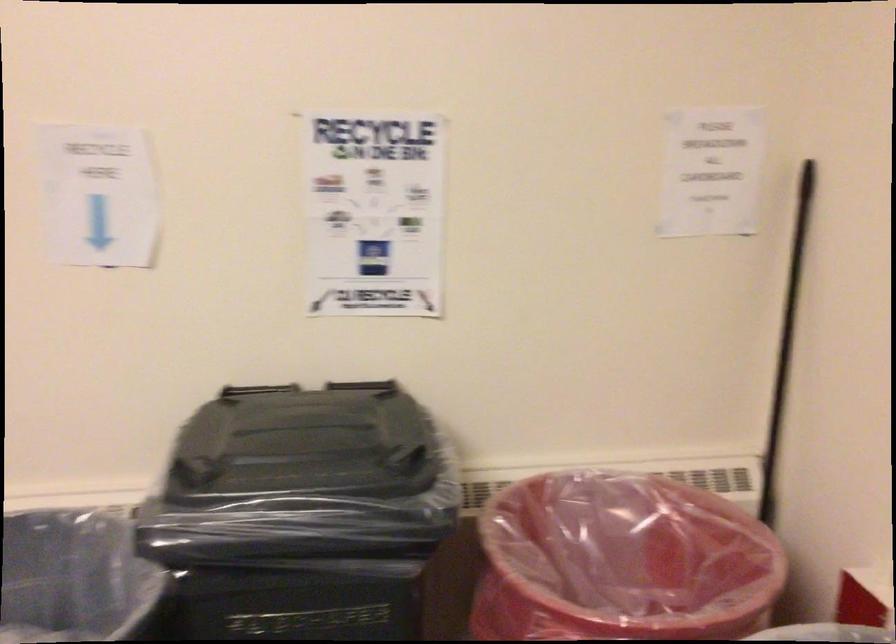
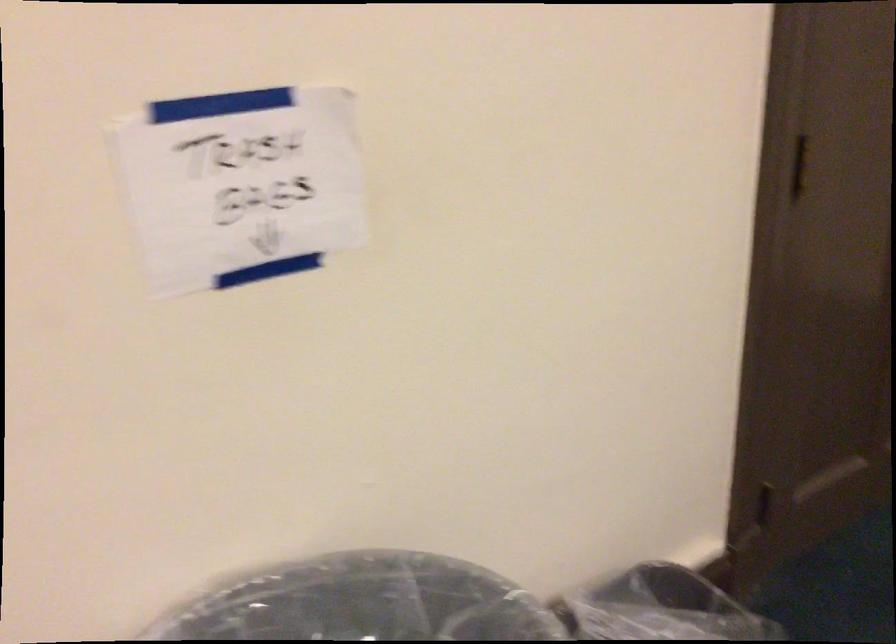
Based on the continuous images, in which direction is the camera rotating?

The camera's rotation is toward right-down.